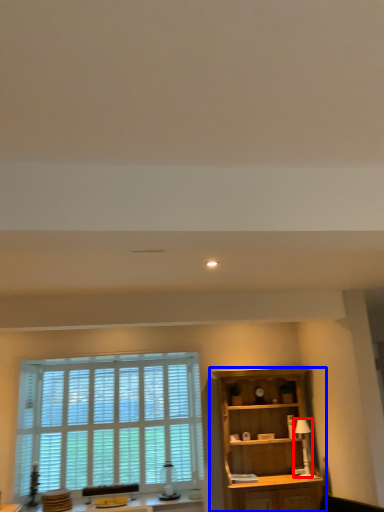
Question: Which object appears farthest to the camera in this image, lamp (highlighted by a red box) or cupboard (highlighted by a blue box)?

Choices:
 (A) lamp
 (B) cupboard

Answer: (A)